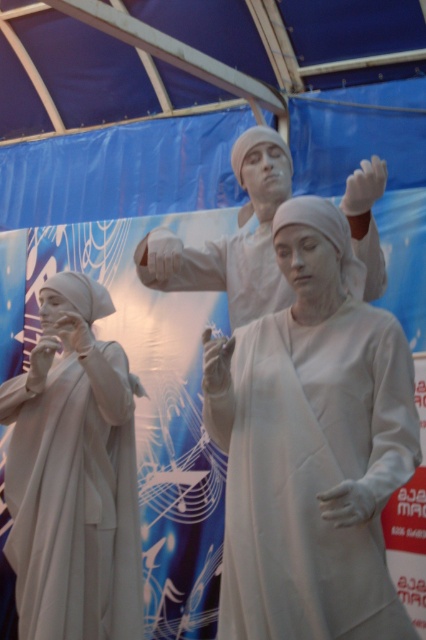
Between point (325, 344) and point (54, 637), which one is positioned in front?

Positioned in front is point (325, 344).

Does point (351, 394) come farther from viewer compared to point (29, 586)?

No, (351, 394) is closer to viewer.

Who is more distant from viewer, (396, 486) or (123, 486)?

Positioned behind is point (123, 486).

In order to click on white matte robe at center in this screenshot , I will do `click(310, 468)`.

Which is more to the left, white matte statue at left or matte white statue at center?

white matte statue at left

Which is behind, point (60, 476) or point (259, 257)?

Point (259, 257)

You are a GUI agent. You are given a task and a screenshot of the screen. Output one action in this format:
    pyautogui.click(x=<x>, y=<y>)
    Task: Click on the white matte statue at left
    The width and height of the screenshot is (426, 640).
    Given the screenshot: What is the action you would take?
    pyautogui.click(x=74, y=474)

Can you confirm if white matte robe at center is smaller than matte white statue at center?

Incorrect, white matte robe at center is not smaller in size than matte white statue at center.

Is point (279, 620) positioned before point (258, 125)?

Yes.

Identify the location of white matte robe at center. (310, 468).